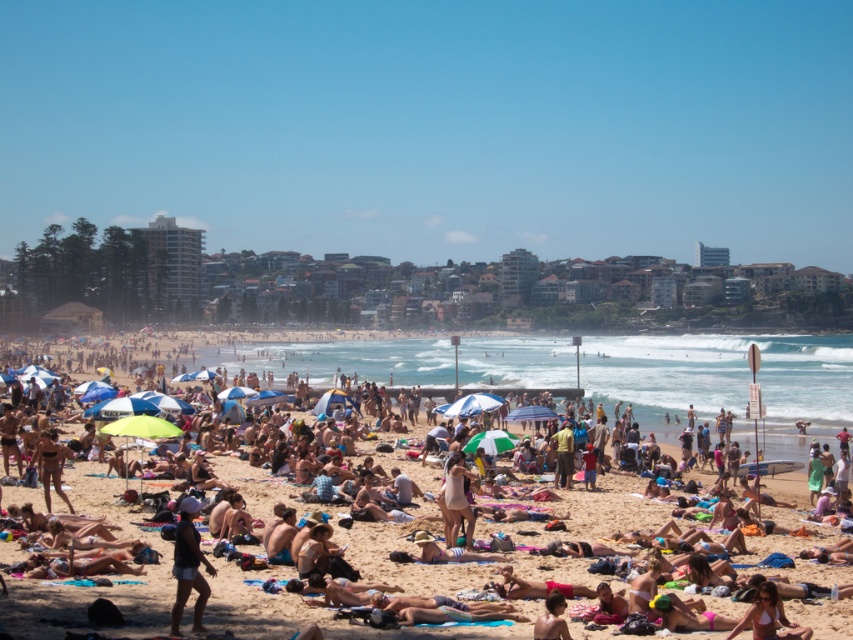
You are a lifeguard on duty and need to reach both the tan skin person at center and the smooth tan skin at lower center. Given your current position, which individual is farther away from you?

The smooth tan skin at lower center is farther away from the lifeguard because the distance between the tan skin person at center and smooth tan skin at lower center is 260.92 feet, implying that the smooth tan skin at lower center is located further away from the center position where the lifeguard might be stationed.